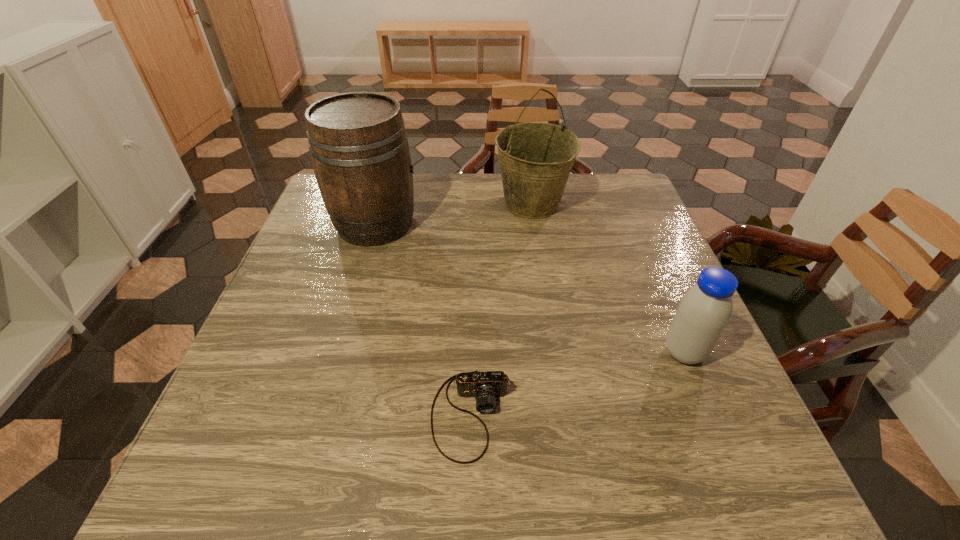
You are a GUI agent. You are given a task and a screenshot of the screen. Output one action in this format:
    pyautogui.click(x=<x>, y=<y>)
    Task: Click on the cider that is at the far edge
    The image size is (960, 540).
    Given the screenshot: What is the action you would take?
    pyautogui.click(x=358, y=144)

At what (x,y) coordinates should I click in order to perform the action: click on object present at the near edge. Please return your answer as a coordinate pair (x, y). Image resolution: width=960 pixels, height=540 pixels. Looking at the image, I should click on (485, 386).

What are the coordinates of `object at the left edge` in the screenshot? It's located at (358, 144).

Identify the location of object located in the right edge section of the desktop. (704, 311).

The image size is (960, 540). Find the location of `object located at the far left corner`. object located at the far left corner is located at coordinates (358, 144).

In the image, there is a desktop. At what (x,y) coordinates should I click in order to perform the action: click on vacant space at the far edge. Please return your answer as a coordinate pair (x, y). Looking at the image, I should click on (468, 208).

Find the location of a particular element. blank area at the near edge is located at coordinates (435, 487).

At what (x,y) coordinates should I click in order to perform the action: click on free location at the left edge of the desktop. Please return your answer as a coordinate pair (x, y). Looking at the image, I should click on (327, 299).

Identify the location of vacant space at the right edge. (648, 267).

I want to click on vacant area at the far right corner of the desktop, so click(x=625, y=204).